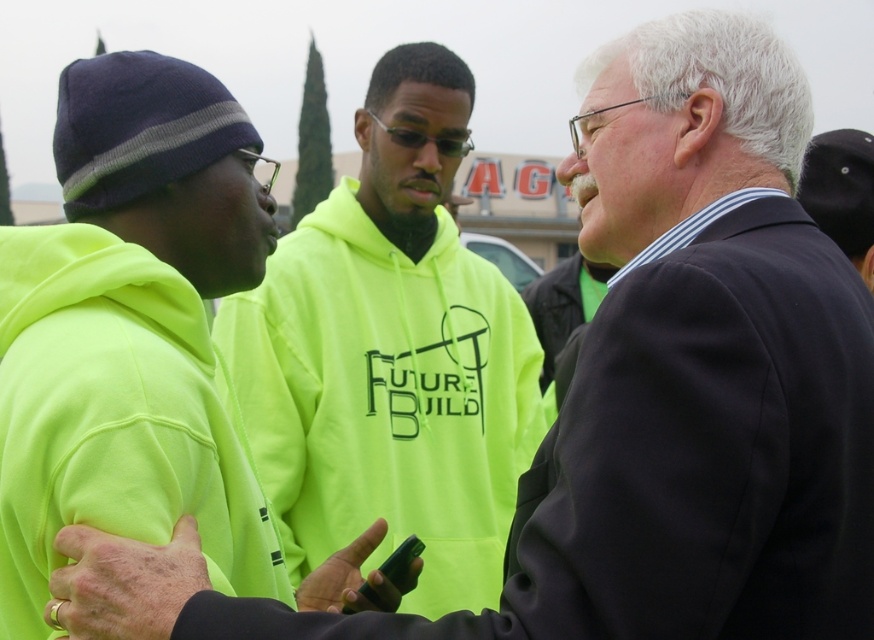
Question: Considering the real-world distances, which object is closest to the neon yellow hoodie at center?

Choices:
 (A) green matte phone at center
 (B) matte yellow-green sleeve at center

Answer: (A)

Question: Which is nearer to the green matte phone at center?

Choices:
 (A) neon yellow hoodie at center
 (B) matte yellow-green sleeve at center

Answer: (B)

Question: Can you confirm if matte yellow-green sleeve at center is bigger than green matte phone at center?

Choices:
 (A) yes
 (B) no

Answer: (B)

Question: Is neon yellow hoodie at center above green matte phone at center?

Choices:
 (A) no
 (B) yes

Answer: (A)

Question: Considering the real-world distances, which object is closest to the green matte phone at center?

Choices:
 (A) neon yellow hoodie at center
 (B) matte yellow-green sleeve at center

Answer: (B)

Question: Is neon yellow hoodie at center bigger than matte yellow-green sleeve at center?

Choices:
 (A) yes
 (B) no

Answer: (B)